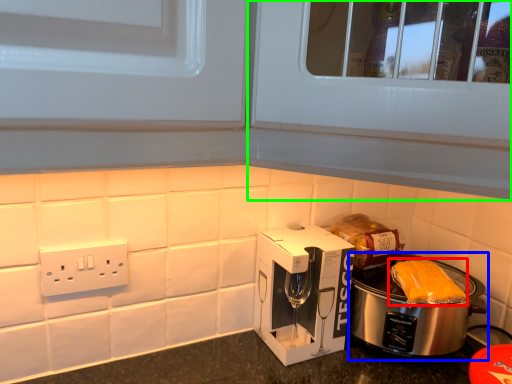
Question: Which object is the farthest from food (highlighted by a red box)? Choose among these: slow cooker (highlighted by a blue box) or glass door (highlighted by a green box).

Choices:
 (A) slow cooker
 (B) glass door

Answer: (B)